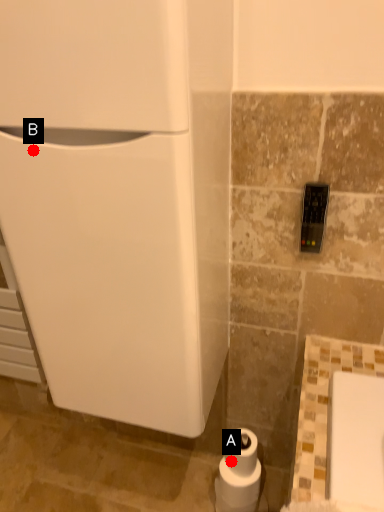
Question: Two points are circled on the image, labeled by A and B beside each circle. Which point is closer to the camera taking this photo?

Choices:
 (A) A is closer
 (B) B is closer

Answer: (B)